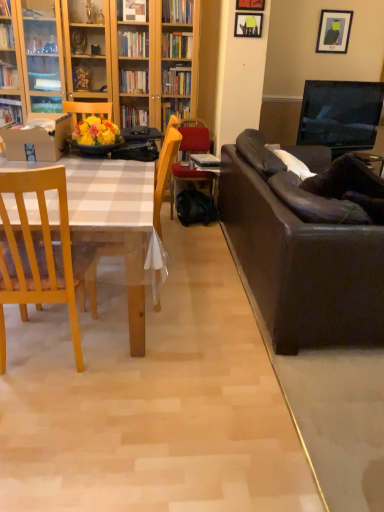
In order to face hardcover book at center, should I rotate leftwards or rightwards?

A 1.932 degree turn to the right will do.

In order to face wooden chair at center, the 3th chair when ordered from front to back, should I rotate leftwards or rightwards?

A 12.374 degree turn to the left will do.

Where is `matte black picture frame at upper right, the third picture frame positioned from the front`? Image resolution: width=384 pixels, height=512 pixels. matte black picture frame at upper right, the third picture frame positioned from the front is located at coordinates (334, 31).

Locate an element on the screen. This screenshot has height=512, width=384. matte black picture frame at upper center, the second picture frame in the front-to-back sequence is located at coordinates (248, 25).

What do you see at coordinates (159, 214) in the screenshot? This screenshot has height=512, width=384. I see `wooden chair at center, the second chair from the back` at bounding box center [159, 214].

Where is `matte cardboard box at left`? The image size is (384, 512). matte cardboard box at left is located at coordinates (37, 138).

What do you see at coordinates (37, 253) in the screenshot? I see `light wood chair at left, the first chair in the front-to-back sequence` at bounding box center [37, 253].

What is the approximate height of light wood chair at left, the first chair in the front-to-back sequence?

light wood chair at left, the first chair in the front-to-back sequence, is 1.01 meters in height.

Locate an element on the screen. hardcover book at center is located at coordinates (205, 160).

Does hardcover book at center come in front of matte cardboard box at left?

No, hardcover book at center is further to the viewer.

From the image's perspective, is hardcover book at center beneath matte cardboard box at left?

Actually, hardcover book at center appears above matte cardboard box at left in the image.

Is hardcover book at center to the left of matte cardboard box at left from the viewer's perspective?

No.

Based on the photo, measure the distance between hardcover book at center and matte cardboard box at left.

They are 1.49 meters apart.

How far apart are matte black picture frame at upper center, acting as the first picture frame starting from the left, and wooden chair at center, positioned as the first chair in back-to-front order?

A distance of 1.36 meters exists between matte black picture frame at upper center, acting as the first picture frame starting from the left, and wooden chair at center, positioned as the first chair in back-to-front order.

Which object is positioned more to the left, matte black picture frame at upper center, the 3th picture frame in the right-to-left sequence, or wooden chair at center, the 3th chair when ordered from front to back?

wooden chair at center, the 3th chair when ordered from front to back, is more to the left.

Which point is more distant from viewer, (242,17) or (98,106)?

The point (98,106) is farther.

Is matte black picture frame at upper center, the second picture frame in the front-to-back sequence, oriented away from wooden chair at center, the 3th chair when ordered from front to back?

matte black picture frame at upper center, the second picture frame in the front-to-back sequence, is not turned away from wooden chair at center, the 3th chair when ordered from front to back.

From a real-world perspective, which is physically below, wooden picture frame at upper center, which ranks as the third picture frame in back-to-front order, or velvet red armchair at center?

velvet red armchair at center.

From the image's perspective, is wooden picture frame at upper center, the second picture frame viewed from the left, on top of velvet red armchair at center?

Yes, from the image's perspective, wooden picture frame at upper center, the second picture frame viewed from the left, is over velvet red armchair at center.

Between wooden picture frame at upper center, the 1th picture frame positioned from the front, and velvet red armchair at center, which one has larger width?

velvet red armchair at center is wider.

Is matte black picture frame at upper right, which is the 3th picture frame in left-to-right order, far away from wooden chair at center, the second chair from the back?

Yes.

In the image, is matte black picture frame at upper right, placed as the first picture frame when sorted from right to left, on the left side or the right side of wooden chair at center, arranged as the 2th chair when viewed from the front?

From the image, it's evident that matte black picture frame at upper right, placed as the first picture frame when sorted from right to left, is to the right of wooden chair at center, arranged as the 2th chair when viewed from the front.

Considering the relative positions of matte black picture frame at upper center, the 3th picture frame in the right-to-left sequence, and matte cardboard box at left in the image provided, is matte black picture frame at upper center, the 3th picture frame in the right-to-left sequence, to the left or to the right of matte cardboard box at left?

Clearly, matte black picture frame at upper center, the 3th picture frame in the right-to-left sequence, is on the right of matte cardboard box at left in the image.

From the image's perspective, which one is positioned higher, matte black picture frame at upper center, acting as the first picture frame starting from the left, or matte cardboard box at left?

matte black picture frame at upper center, acting as the first picture frame starting from the left.

Is point (251, 21) positioned before point (45, 146)?

No, it is behind (45, 146).

In the scene shown: Could you tell me if matte black picture frame at upper center, the 3th picture frame in the right-to-left sequence, is facing matte cardboard box at left?

No, matte black picture frame at upper center, the 3th picture frame in the right-to-left sequence, does not turn towards matte cardboard box at left.

Based on the photo, who is smaller, hardcover book at center or matte black picture frame at upper center, the second picture frame in the front-to-back sequence?

matte black picture frame at upper center, the second picture frame in the front-to-back sequence, is smaller.

Does hardcover book at center come in front of matte black picture frame at upper center, which ranks as the second picture frame in back-to-front order?

No, it is behind matte black picture frame at upper center, which ranks as the second picture frame in back-to-front order.

Can matte black picture frame at upper center, the 3th picture frame in the right-to-left sequence, be found inside hardcover book at center?

No, matte black picture frame at upper center, the 3th picture frame in the right-to-left sequence, is located outside of hardcover book at center.

Is hardcover book at center placed right next to matte black picture frame at upper center, which ranks as the second picture frame in back-to-front order?

No, hardcover book at center is not in contact with matte black picture frame at upper center, which ranks as the second picture frame in back-to-front order.

From the image's perspective, is wooden chair at center, the 3th chair when ordered from front to back, over light wood chair at left, the first chair in the front-to-back sequence?

Correct, wooden chair at center, the 3th chair when ordered from front to back, appears higher than light wood chair at left, the first chair in the front-to-back sequence, in the image.

Is wooden chair at center, the 3th chair when ordered from front to back, positioned behind light wood chair at left, the 3th chair when ordered from back to front?

Yes, wooden chair at center, the 3th chair when ordered from front to back, is further from the camera.

From a real-world perspective, is wooden chair at center, positioned as the first chair in back-to-front order, physically located above or below light wood chair at left, the 3th chair when ordered from back to front?

In terms of real-world spatial position, wooden chair at center, positioned as the first chair in back-to-front order, is above light wood chair at left, the 3th chair when ordered from back to front.

Could you measure the distance between wooden chair at center, positioned as the first chair in back-to-front order, and light wood chair at left, the 3th chair when ordered from back to front?

The distance of wooden chair at center, positioned as the first chair in back-to-front order, from light wood chair at left, the 3th chair when ordered from back to front, is 2.03 meters.

The height and width of the screenshot is (512, 384). In order to click on box that appears in front of the hardcover book at center in this screenshot , I will do `click(37, 138)`.

Find the location of a particular element. This screenshot has width=384, height=512. the 1st chair positioned below the matte black picture frame at upper center, the second picture frame in the front-to-back sequence (from the image's perspective) is located at coordinates (87, 109).

Looking at the image, which one is located closer to hardcover book at center, wooden chair at center, arranged as the 2th chair when viewed from the front, or wooden chair at center, positioned as the first chair in back-to-front order?

wooden chair at center, positioned as the first chair in back-to-front order, is positioned closer to the anchor hardcover book at center.

When comparing their distances from wooden picture frame at upper center, which ranks as the third picture frame in back-to-front order, does matte black picture frame at upper center, acting as the first picture frame starting from the left, or wooden chair at center, arranged as the 2th chair when viewed from the front, seem closer?

Among the two, matte black picture frame at upper center, acting as the first picture frame starting from the left, is located nearer to wooden picture frame at upper center, which ranks as the third picture frame in back-to-front order.

Based on their spatial positions, is matte black picture frame at upper right, placed as the first picture frame when sorted from right to left, or wooden chair at center, positioned as the first chair in back-to-front order, further from wooden chair at center, arranged as the 2th chair when viewed from the front?

matte black picture frame at upper right, placed as the first picture frame when sorted from right to left.

Based on their spatial positions, is velvet red armchair at center or wooden picture frame at upper center, the 1th picture frame positioned from the front, closer to matte black picture frame at upper right, which is the 3th picture frame in left-to-right order?

Among the two, wooden picture frame at upper center, the 1th picture frame positioned from the front, is located nearer to matte black picture frame at upper right, which is the 3th picture frame in left-to-right order.

When comparing their distances from hardcover book at center, does wooden picture frame at upper center, which ranks as the third picture frame in back-to-front order, or velvet red armchair at center seem closer?

velvet red armchair at center is positioned closer to the anchor hardcover book at center.

In the scene shown: From the image, which object appears to be nearer to matte black picture frame at upper center, which ranks as the second picture frame in back-to-front order, wooden picture frame at upper center, the second picture frame viewed from the left, or matte black picture frame at upper right, the third picture frame positioned from the front?

Based on the image, wooden picture frame at upper center, the second picture frame viewed from the left, appears to be nearer to matte black picture frame at upper center, which ranks as the second picture frame in back-to-front order.

From the image, which object appears to be nearer to matte cardboard box at left, velvet red armchair at center or matte black picture frame at upper right, which is the 3th picture frame in left-to-right order?

velvet red armchair at center is closer to matte cardboard box at left.

Looking at the image, which one is located further to light wood chair at left, the first chair in the front-to-back sequence, matte cardboard box at left or matte black picture frame at upper center, acting as the first picture frame starting from the left?

A: The object further to light wood chair at left, the first chair in the front-to-back sequence, is matte black picture frame at upper center, acting as the first picture frame starting from the left.

The image size is (384, 512). I want to click on chair between matte cardboard box at left and hardcover book at center along the z-axis, so click(x=87, y=109).

What are the coordinates of `armchair between wooden chair at center, arranged as the 2th chair when viewed from the front, and hardcover book at center in the front-back direction` in the screenshot? It's located at (192, 135).

What are the coordinates of `book between matte black picture frame at upper right, which is the 3th picture frame in left-to-right order, and velvet red armchair at center vertically` in the screenshot? It's located at (205, 160).

At what (x,y) coordinates should I click in order to perform the action: click on chair between matte cardboard box at left and velvet red armchair at center from front to back. Please return your answer as a coordinate pair (x, y). This screenshot has width=384, height=512. Looking at the image, I should click on (87, 109).